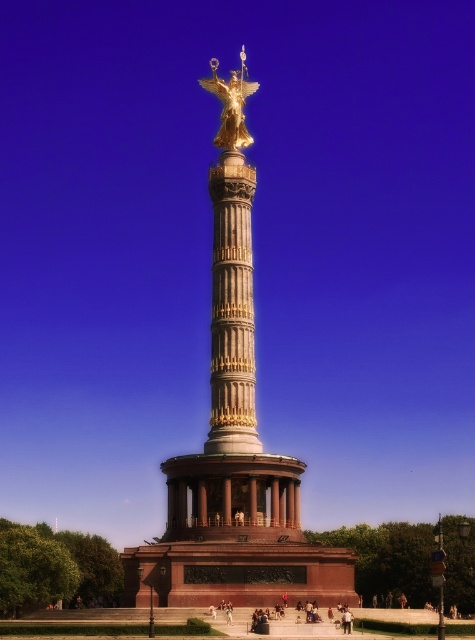
How far apart are gold metallic statue at upper center and light brown wooden bench at center?

A distance of 191.73 feet exists between gold metallic statue at upper center and light brown wooden bench at center.

Is gold metallic statue at upper center above light brown wooden bench at center?

Indeed, gold metallic statue at upper center is positioned over light brown wooden bench at center.

This screenshot has width=475, height=640. Describe the element at coordinates (230, 104) in the screenshot. I see `gold metallic statue at upper center` at that location.

Where is `gold metallic statue at upper center`? gold metallic statue at upper center is located at coordinates point(230,104).

Is gold/gilded column at center to the right of golden statue at center from the viewer's perspective?

In fact, gold/gilded column at center is to the left of golden statue at center.

Between gold/gilded column at center and golden statue at center, which one appears on the left side from the viewer's perspective?

Positioned to the left is gold/gilded column at center.

Where is `gold/gilded column at center`? This screenshot has width=475, height=640. gold/gilded column at center is located at coordinates (231, 308).

The height and width of the screenshot is (640, 475). Identify the location of gold/gilded column at center. [x=231, y=308].

What do you see at coordinates (230, 104) in the screenshot? The height and width of the screenshot is (640, 475). I see `gold metallic statue at upper center` at bounding box center [230, 104].

Is point (221, 122) closer to camera compared to point (228, 604)?

No, it is not.

The image size is (475, 640). I want to click on gold metallic statue at upper center, so click(230, 104).